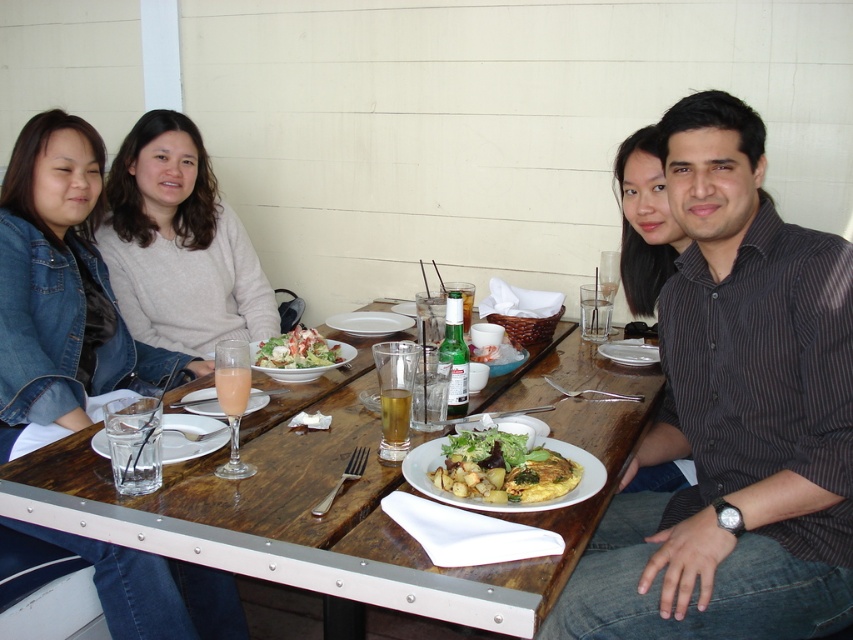
You are a waiter at this outdoor dining table. You need to place a new drink order for the person wearing the black striped shirt at right. Where should you place the drink to ensure it is closest to their current position but not overlapping with the translucent glass at table center?

The drink should be placed near the black striped shirt at right but not overlapping with the translucent glass at table center. Since the black striped shirt at right is bigger than the translucent glass at table center, the drink can be positioned closer to the shirt while maintaining a clear space between them.

You are a waiter at this outdoor dining table. You need to place a new dessert plate between the clear glass plate at lower left and the white matte plate at center. Based on their positions, where should you place the dessert plate?

The clear glass plate at lower left is below the white matte plate at center, so you should place the dessert plate between them by positioning it above the clear glass plate at lower left and below the white matte plate at center.

You are standing 4 feet away from the table in the image. There is a point at coordinates point (840, 564) on the table. Can you reach this point without moving closer to the table?

The distance of point (840, 564) from viewer is 3.81 feet, so yes, you can reach it without moving closer since you are already 4 feet away, which is slightly farther than the point.